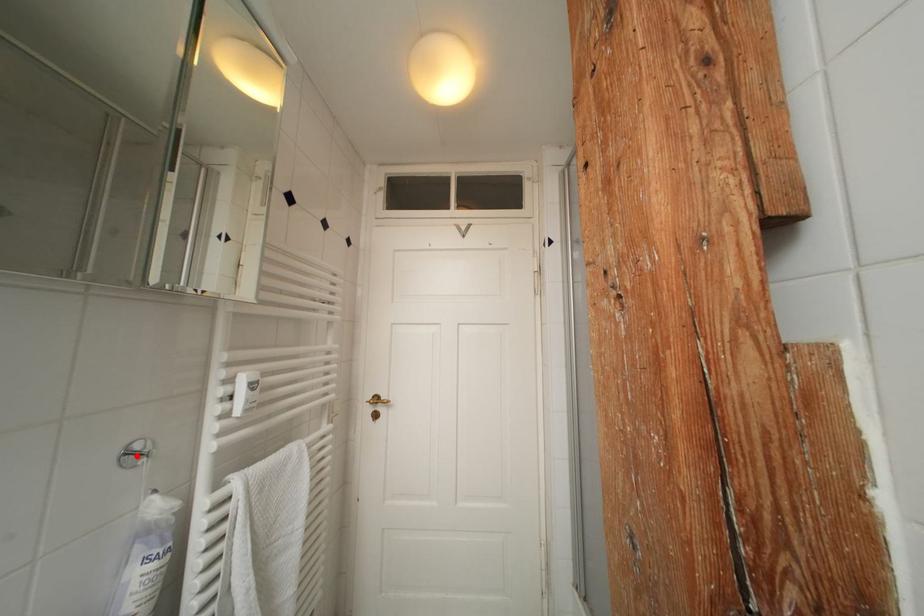
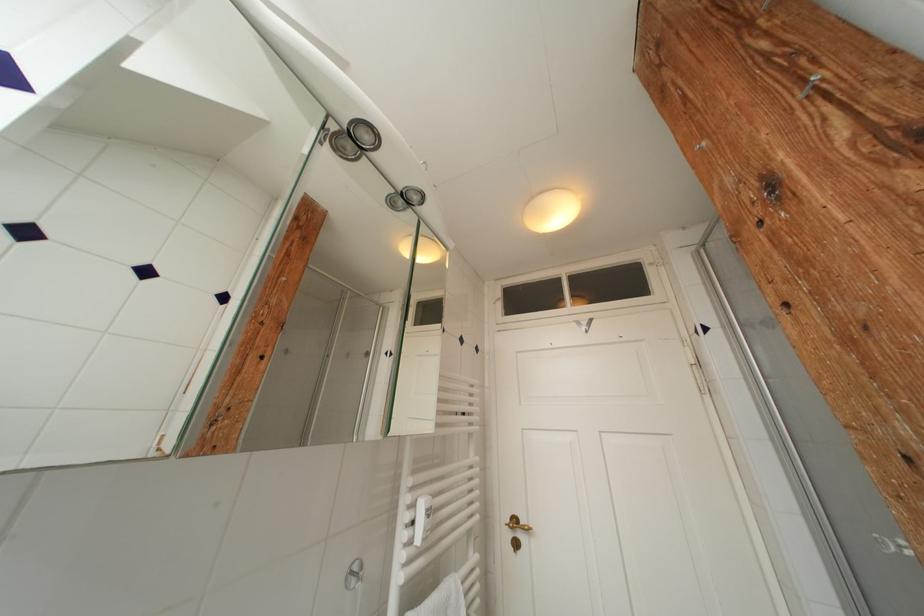
The point at the highlighted location is marked in the first image. Where is the corresponding point in the second image?

(358, 578)